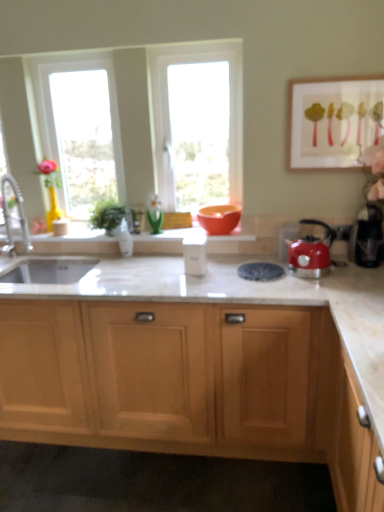
Identify the location of vacant space to the right of clear glass vase at center, the 1th glass vase positioned from the left. (152, 259).